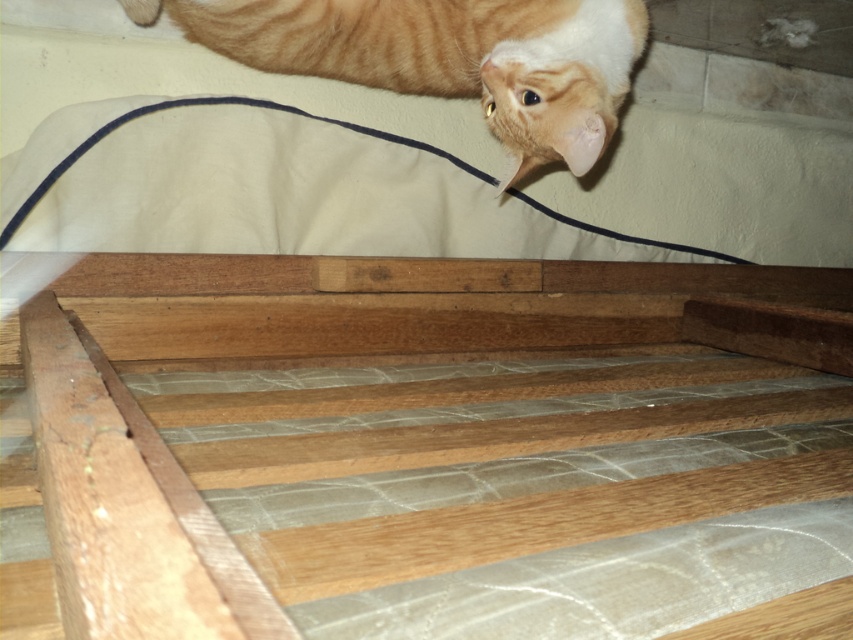
Is point (711, 371) farther from viewer compared to point (628, 32)?

Yes, point (711, 371) is behind point (628, 32).

What do you see at coordinates (425, 449) in the screenshot? I see `wooden slats at center` at bounding box center [425, 449].

Identify the location of wooden slats at center. Image resolution: width=853 pixels, height=640 pixels. (425, 449).